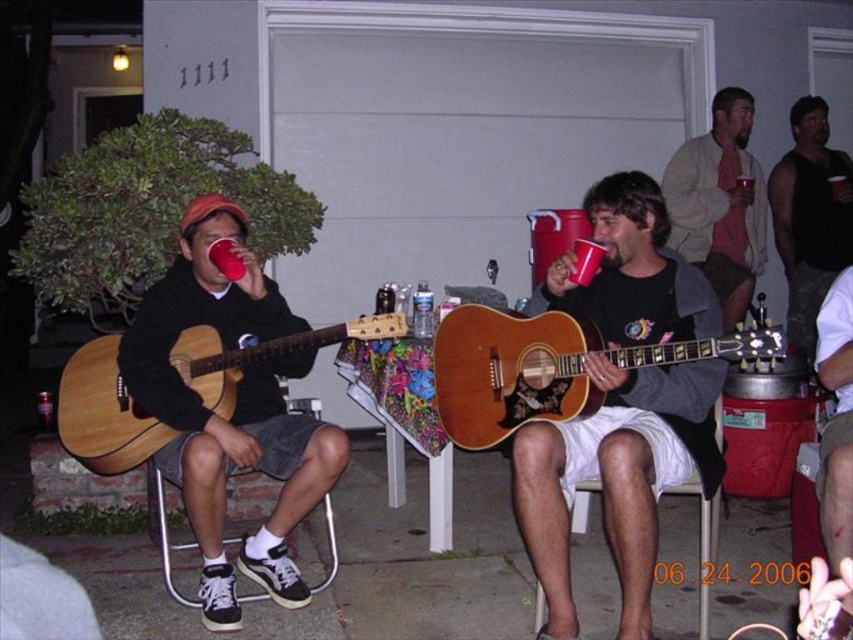
Does point (286, 442) come behind point (827, 380)?

Yes, it is.

Is point (149, 358) positioned in front of point (849, 321)?

No, (149, 358) is behind (849, 321).

What do you see at coordinates (234, 410) in the screenshot? I see `matte black guitar at left` at bounding box center [234, 410].

Where is `matte black guitar at left`? The height and width of the screenshot is (640, 853). matte black guitar at left is located at coordinates (234, 410).

Does natural wood acoustic guitar at left have a lesser height compared to red plastic cup at upper center?

In fact, natural wood acoustic guitar at left may be taller than red plastic cup at upper center.

Who is positioned more to the left, natural wood acoustic guitar at left or red plastic cup at upper center?

Positioned to the left is natural wood acoustic guitar at left.

Who is more forward, [184,368] or [751,182]?

Point [184,368]

Image resolution: width=853 pixels, height=640 pixels. What are the coordinates of `natural wood acoustic guitar at left` in the screenshot? It's located at (x=103, y=412).

Which is below, light beige sweater at upper right or white fabric chair at lower center?

white fabric chair at lower center is lower down.

The width and height of the screenshot is (853, 640). What do you see at coordinates (718, 204) in the screenshot? I see `light beige sweater at upper right` at bounding box center [718, 204].

In order to click on light beige sweater at upper right in this screenshot , I will do `click(718, 204)`.